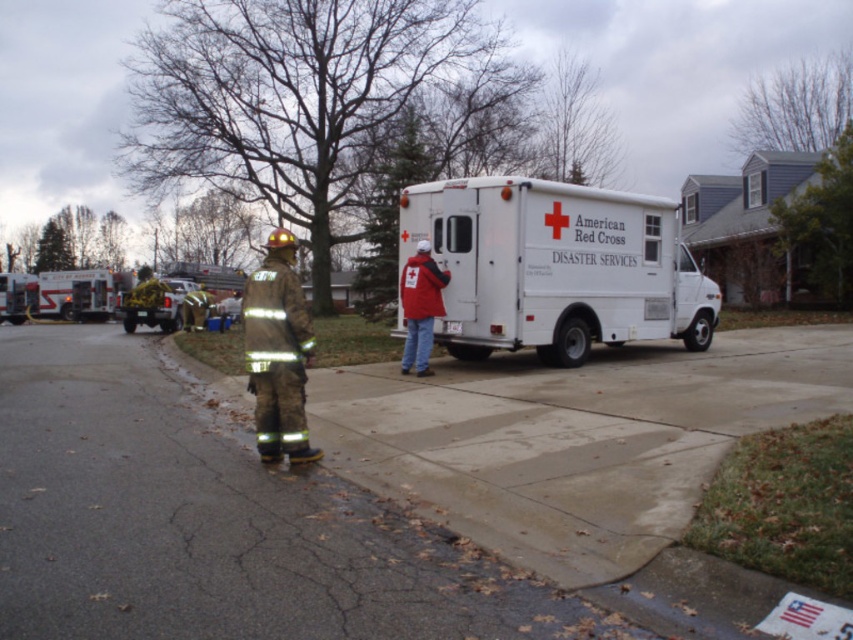
Question: Among these points, which one is farthest from the camera?

Choices:
 (A) (474, 204)
 (B) (297, 321)

Answer: (A)

Question: Is yellow reflective truck at left bigger than reflective fabric fireman at center?

Choices:
 (A) no
 (B) yes

Answer: (B)

Question: Can you confirm if brushed metal fire truck at left is wider than reflective fabric fireman at center?

Choices:
 (A) no
 (B) yes

Answer: (B)

Question: Observing the image, what is the correct spatial positioning of camouflage fabric fireman at center in reference to reflective gold fireman at center?

Choices:
 (A) above
 (B) below

Answer: (B)

Question: Considering the real-world distances, which object is farthest from the reflective gold fireman at center?

Choices:
 (A) camouflage fabric fireman at center
 (B) yellow reflective truck at left
 (C) reflective fabric fireman at center
 (D) brushed metal fire truck at left

Answer: (A)

Question: Which point is closer to the camera taking this photo?

Choices:
 (A) (73, 276)
 (B) (555, 225)
 (C) (428, 296)

Answer: (C)